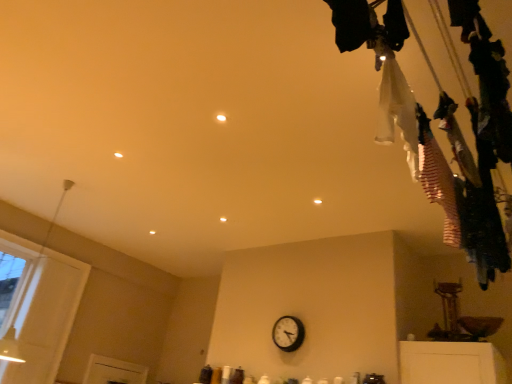
Question: Is black plastic wall clock at center turned away from white striped fabric at upper right, positioned as the 1th clothing in right-to-left order?

Choices:
 (A) yes
 (B) no

Answer: (B)

Question: Is black plastic wall clock at center facing towards white striped fabric at upper right, the second clothing from the left?

Choices:
 (A) no
 (B) yes

Answer: (A)

Question: Is black plastic wall clock at center smaller than white striped fabric at upper right, positioned as the 1th clothing in right-to-left order?

Choices:
 (A) yes
 (B) no

Answer: (A)

Question: Would you say black plastic wall clock at center is outside white striped fabric at upper right, the second clothing from the left?

Choices:
 (A) yes
 (B) no

Answer: (A)

Question: From the image's perspective, is black plastic wall clock at center over white striped fabric at upper right, the second clothing from the left?

Choices:
 (A) no
 (B) yes

Answer: (A)

Question: From the image's perspective, is black plastic wall clock at center positioned above or below white striped fabric at upper right, the second clothing from the left?

Choices:
 (A) below
 (B) above

Answer: (A)

Question: Is black plastic wall clock at center inside the boundaries of white striped fabric at upper right, positioned as the 1th clothing in right-to-left order, or outside?

Choices:
 (A) outside
 (B) inside

Answer: (A)

Question: Looking at their shapes, would you say black plastic wall clock at center is wider or thinner than white striped fabric at upper right, positioned as the 1th clothing in right-to-left order?

Choices:
 (A) thin
 (B) wide

Answer: (A)

Question: Is black plastic wall clock at center bigger or smaller than white striped fabric at upper right, positioned as the 1th clothing in right-to-left order?

Choices:
 (A) small
 (B) big

Answer: (A)

Question: Considering the positions of white striped fabric at upper right, the second clothing from the left, and black plastic wall clock at center in the image, is white striped fabric at upper right, the second clothing from the left, bigger or smaller than black plastic wall clock at center?

Choices:
 (A) small
 (B) big

Answer: (B)

Question: Considering the positions of point (426, 193) and point (280, 344), is point (426, 193) closer or farther from the camera than point (280, 344)?

Choices:
 (A) farther
 (B) closer

Answer: (B)

Question: In the image, is white striped fabric at upper right, the second clothing from the left, on the left side or the right side of black plastic wall clock at center?

Choices:
 (A) left
 (B) right

Answer: (B)

Question: Is white striped fabric at upper right, the second clothing from the left, wider or thinner than black plastic wall clock at center?

Choices:
 (A) thin
 (B) wide

Answer: (B)

Question: Do you think white striped fabric at upper right, the second clothing from the left, is within white fabric at upper right, the second clothing in the right-to-left sequence, or outside of it?

Choices:
 (A) outside
 (B) inside

Answer: (A)

Question: Is white striped fabric at upper right, positioned as the 1th clothing in right-to-left order, bigger or smaller than white fabric at upper right, placed as the 1th clothing when sorted from left to right?

Choices:
 (A) small
 (B) big

Answer: (B)